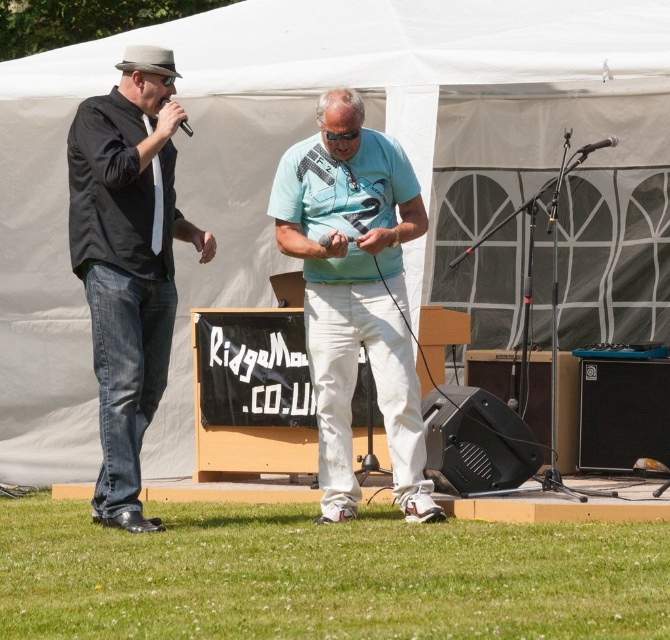
You are standing at the center of the event area. There are two points marked in the image. The first point is at coordinates point (x=105, y=186) and the second point is at point (x=186, y=131). Which point is closer to you?

Point (x=186, y=131) is closer to you because it is in front of point (x=105, y=186).

You are organizing a photo shoot and need to ensure that the light blue cotton shirt at center and the black plastic microphone at upper left are both visible in the frame. Given their sizes, which object should you prioritize positioning closer to the camera to maintain clarity?

The light blue cotton shirt at center is larger than the black plastic microphone at upper left, so you should prioritize positioning the black plastic microphone at upper left closer to the camera to maintain clarity.

You are a sound technician at the event and need to adjust the microphones. Which microphone, the black matte microphone at center or the black plastic microphone at upper left, is positioned farther away from the audience standing in front of the stage?

The black plastic microphone at upper left is behind the black matte microphone at center, so it is positioned farther away from the audience standing in front of the stage.